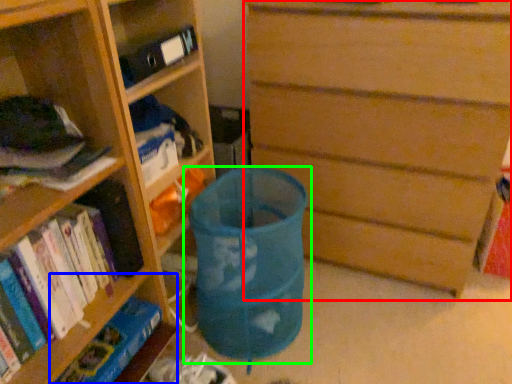
Question: Which object is the farthest from chest of drawers (highlighted by a red box)? Choose among these: shelf (highlighted by a blue box) or waste container (highlighted by a green box).

Choices:
 (A) shelf
 (B) waste container

Answer: (A)